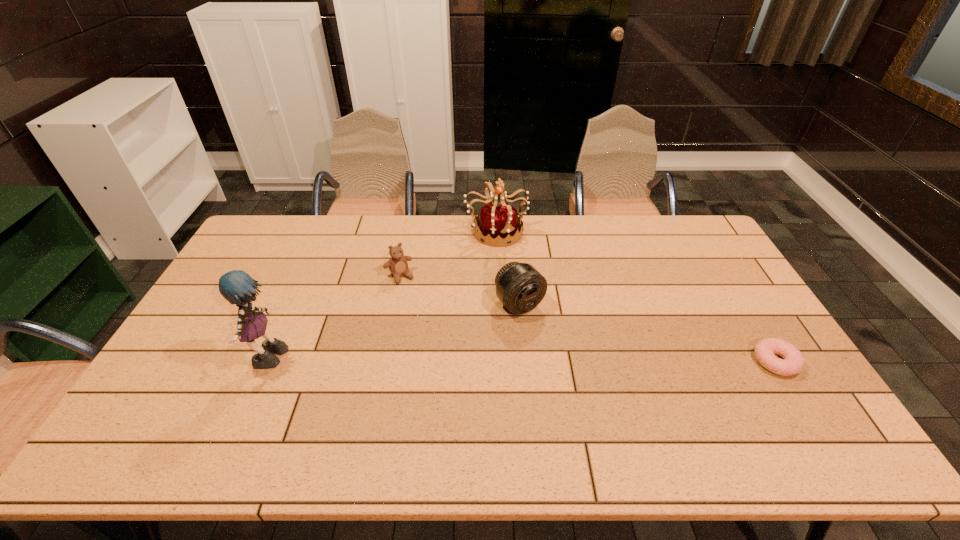
Where is `vacant space situated 0.300m on the front-facing side of the tiara`? This screenshot has height=540, width=960. vacant space situated 0.300m on the front-facing side of the tiara is located at coordinates (549, 304).

Locate an element on the screen. The height and width of the screenshot is (540, 960). free space located on the front-facing side of the tiara is located at coordinates (519, 264).

Locate an element on the screen. free space located on the front-facing side of the tiara is located at coordinates (525, 271).

I want to click on object located at the far edge, so click(502, 221).

Locate an element on the screen. The width and height of the screenshot is (960, 540). object present at the right edge is located at coordinates (793, 363).

This screenshot has height=540, width=960. In the image, there is a desktop. In order to click on vacant space at the far edge in this screenshot , I will do `click(591, 230)`.

Locate an element on the screen. This screenshot has width=960, height=540. free space at the near edge of the desktop is located at coordinates (213, 411).

The height and width of the screenshot is (540, 960). In the image, there is a desktop. Find the location of `vacant space at the left edge`. vacant space at the left edge is located at coordinates (198, 372).

You are a GUI agent. You are given a task and a screenshot of the screen. Output one action in this format:
    pyautogui.click(x=<x>, y=<y>)
    Task: Click on the vacant space at the right edge of the desktop
    
    Given the screenshot: What is the action you would take?
    [x=732, y=282]

In order to click on vacant space at the far left corner of the desktop in this screenshot , I will do `click(273, 240)`.